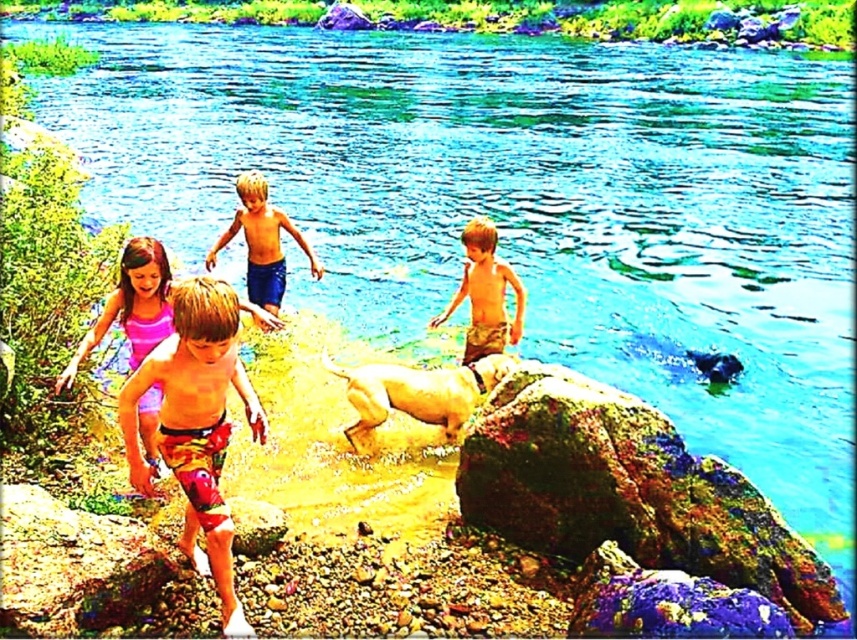
Question: Does smooth brown rock at lower left come in front of camouflage shorts at center?

Choices:
 (A) no
 (B) yes

Answer: (B)

Question: Which of the following is the farthest from the observer?

Choices:
 (A) (259, 308)
 (B) (511, 330)
 (C) (64, 602)

Answer: (B)

Question: Is smooth brown rock at lower left smaller than blue denim shorts at center?

Choices:
 (A) no
 (B) yes

Answer: (B)

Question: Which point is farther to the camera?

Choices:
 (A) (475, 276)
 (B) (243, 177)
 (C) (55, 588)
 (D) (93, 337)

Answer: (B)

Question: Estimate the real-world distances between objects in this image. Which object is closer to the camouflage shorts at center?

Choices:
 (A) pink fabric dress at center
 (B) smooth brown rock at lower left

Answer: (A)

Question: Is camouflage shorts at center to the left of blue denim shorts at center from the viewer's perspective?

Choices:
 (A) no
 (B) yes

Answer: (A)